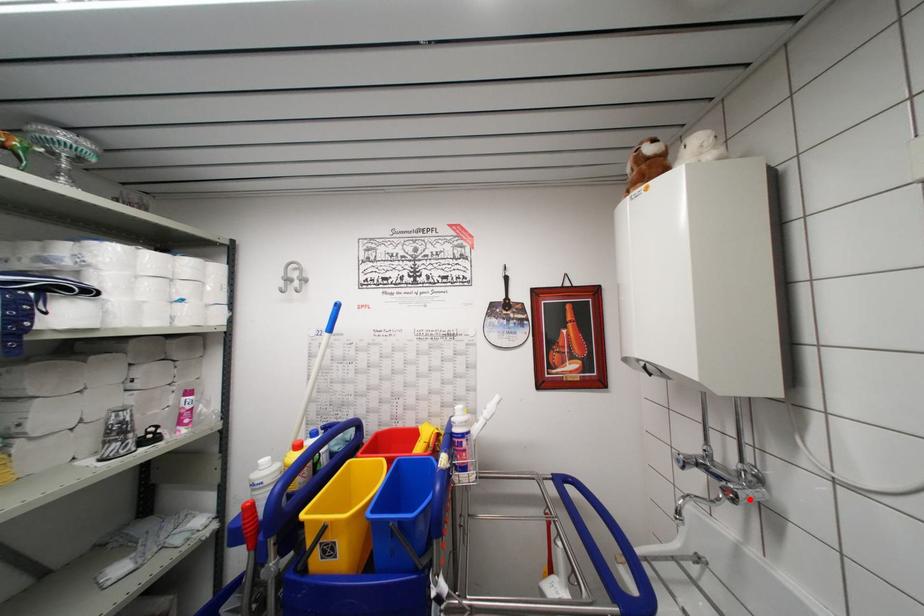
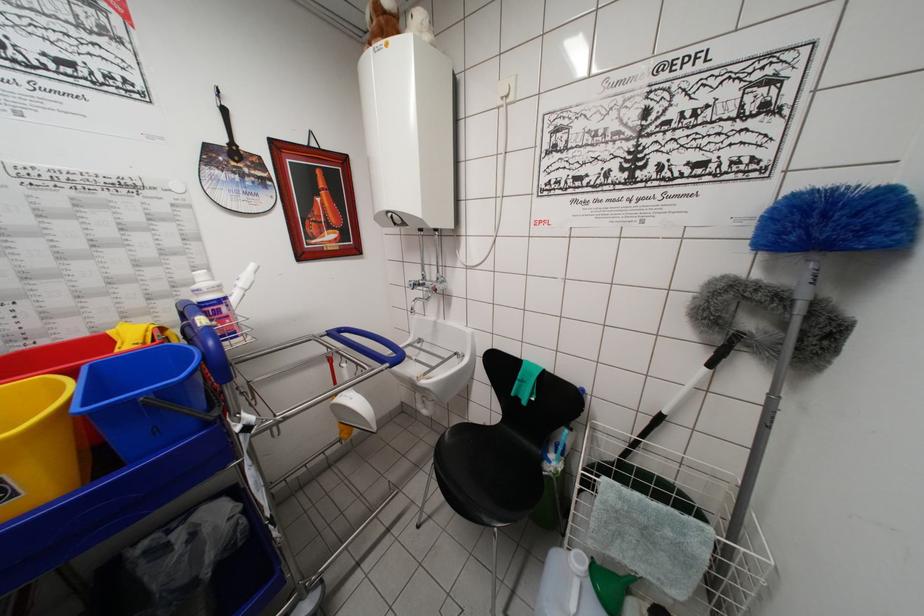
Where in the second image is the point corresponding to the highlighted location from the first image?

(443, 292)